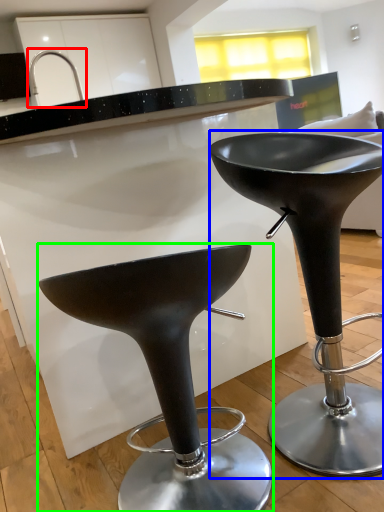
Question: Considering the real-world distances, which object is farthest from faucet (highlighted by a red box)? stool (highlighted by a blue box) or stool (highlighted by a green box)?

Choices:
 (A) stool
 (B) stool

Answer: (B)